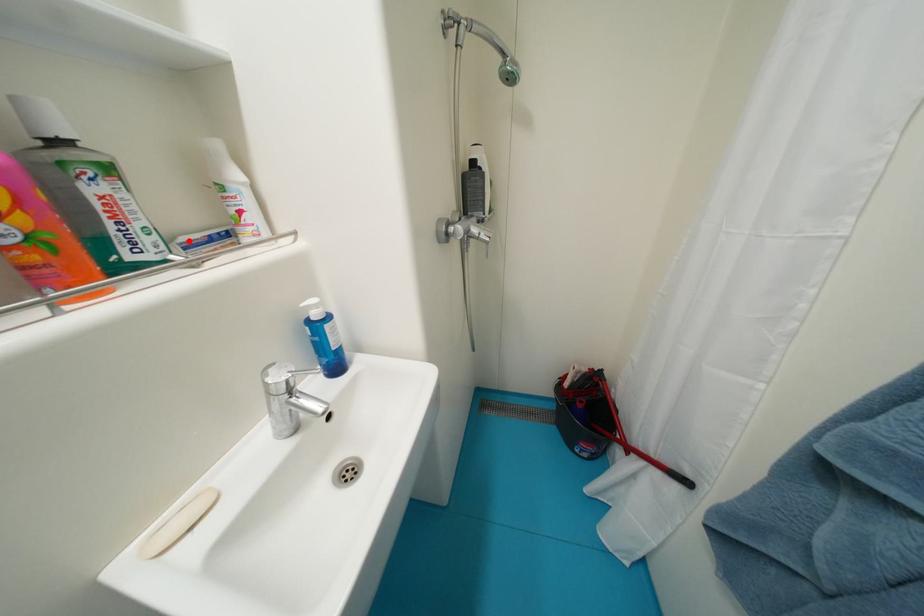
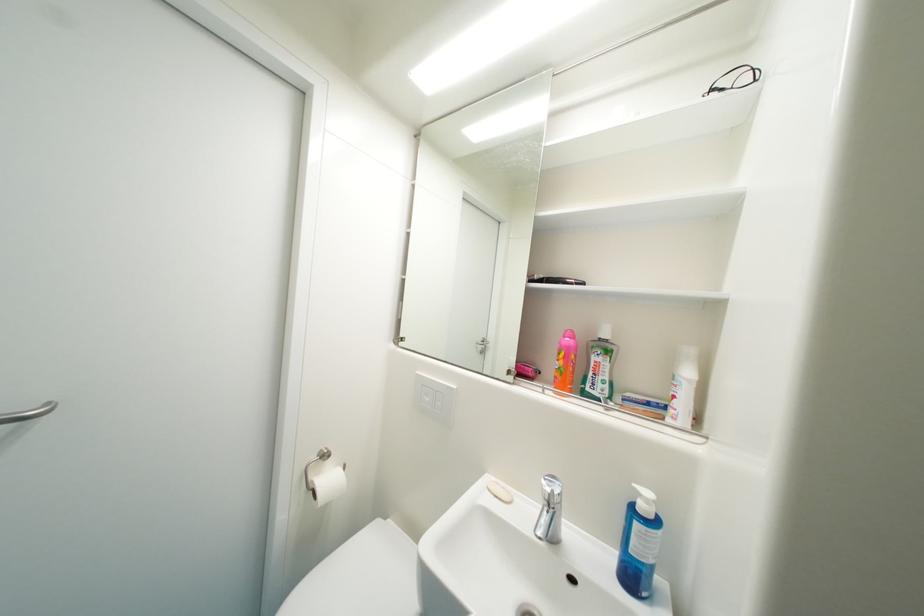
Locate, in the second image, the point that corresponds to the highlighted location in the first image.

(635, 397)